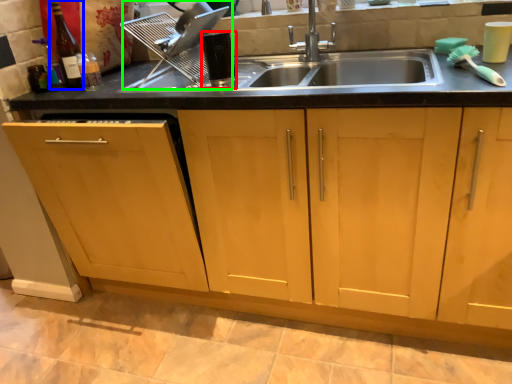
Question: Estimate the real-world distances between objects in this image. Which object is closer to appliance (highlighted by a red box), bottle (highlighted by a blue box) or appliance (highlighted by a green box)?

Choices:
 (A) bottle
 (B) appliance

Answer: (B)